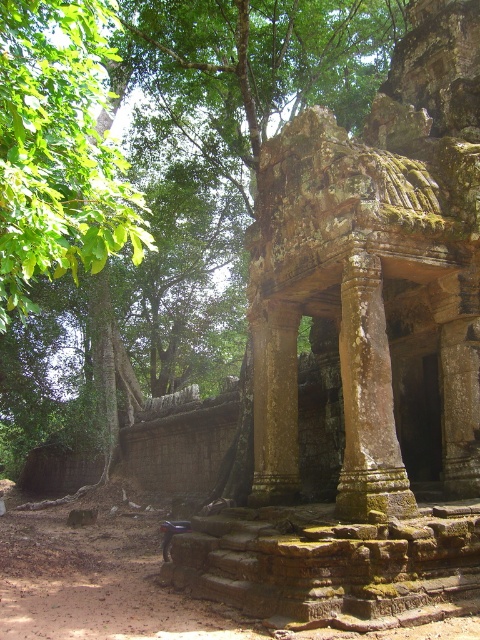
You are an archaeologist examining the ancient stone structure. You notice the green leafy tree at upper left and the weathered stone column at center. Which object is located to the left of the other?

The green leafy tree at upper left is positioned on the left side of the weathered stone column at center.

You are an archaeologist standing near the weathered stone column at center. You want to take a photo of the green leafy tree at upper left from your current position. Is the tree within your camera lens range if your camera can capture objects up to 10 meters away?

The green leafy tree at upper left is 10.79 meters from the weathered stone column at center. Since your camera can only capture up to 10 meters, the tree is slightly out of range and cannot be photographed from your current position.